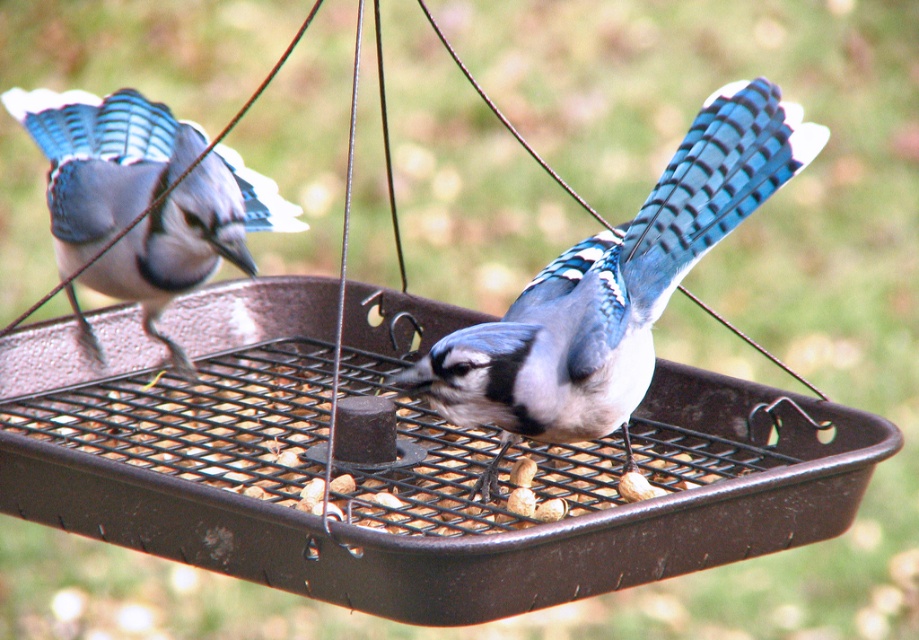
You are a birdwatcher observing the two blue jays at the bird feeder. You notice the blue glossy feathers at center and the matte blue feathers at left. Which of these two objects is positioned to the right side of the other?

The blue glossy feathers at center is positioned to the right of the matte blue feathers at left.

You are standing at the point labeled point (467,403) and want to know how far you are from the viewer. Can you determine the distance?

The distance between point (467,403) and the viewer is 1.49 meters.

You are a bird enthusiast observing the two blue jays at the feeder. You notice the blue glossy feathers at center and the matte blue feathers at left. How far apart are these two sets of feathers?

The blue glossy feathers at center is 18.13 inches from matte blue feathers at left.